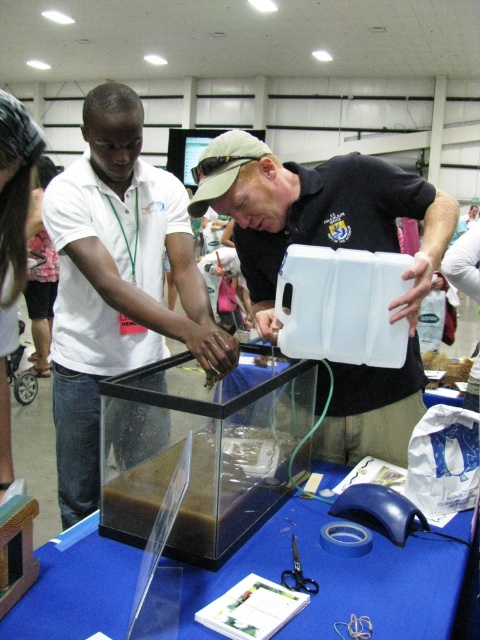
Question: Does white shirt at center appear under white matte container at center?

Choices:
 (A) no
 (B) yes

Answer: (B)

Question: Which object is the farthest from the white matte container at center?

Choices:
 (A) blue plastic table at center
 (B) white shirt at center

Answer: (A)

Question: Which object is closer to the camera taking this photo?

Choices:
 (A) white matte container at center
 (B) white shirt at center

Answer: (B)

Question: Can you confirm if white shirt at center is positioned to the left of blue plastic table at center?

Choices:
 (A) no
 (B) yes

Answer: (B)

Question: Can you confirm if white shirt at center is bigger than blue plastic table at center?

Choices:
 (A) no
 (B) yes

Answer: (B)

Question: Which object is closer to the camera taking this photo?

Choices:
 (A) white shirt at center
 (B) white matte container at center

Answer: (A)